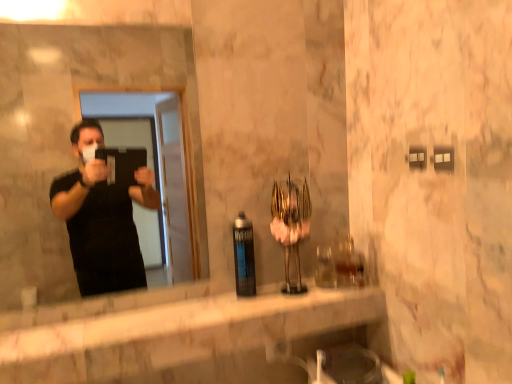
Where is `free space above white marble counter at center (from a real-world perspective)`? The image size is (512, 384). free space above white marble counter at center (from a real-world perspective) is located at coordinates (193, 312).